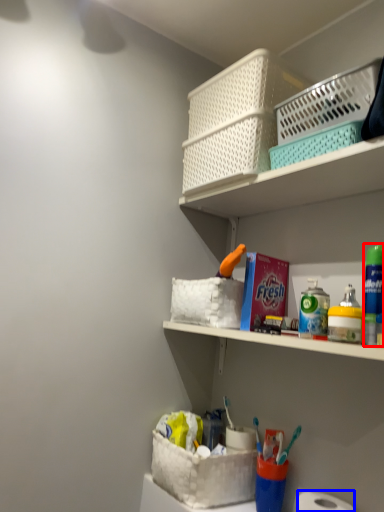
Question: Which object appears farthest to the camera in this image, mouthwash (highlighted by a red box) or toilet paper (highlighted by a blue box)?

Choices:
 (A) mouthwash
 (B) toilet paper

Answer: (A)